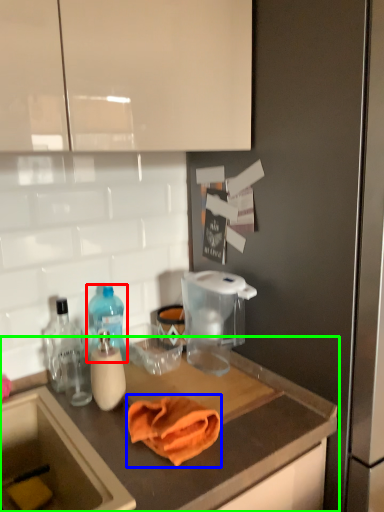
Question: Estimate the real-world distances between objects in this image. Which object is closer to bottle (highlighted by a red box), bath towel (highlighted by a blue box) or countertop (highlighted by a green box)?

Choices:
 (A) bath towel
 (B) countertop

Answer: (A)